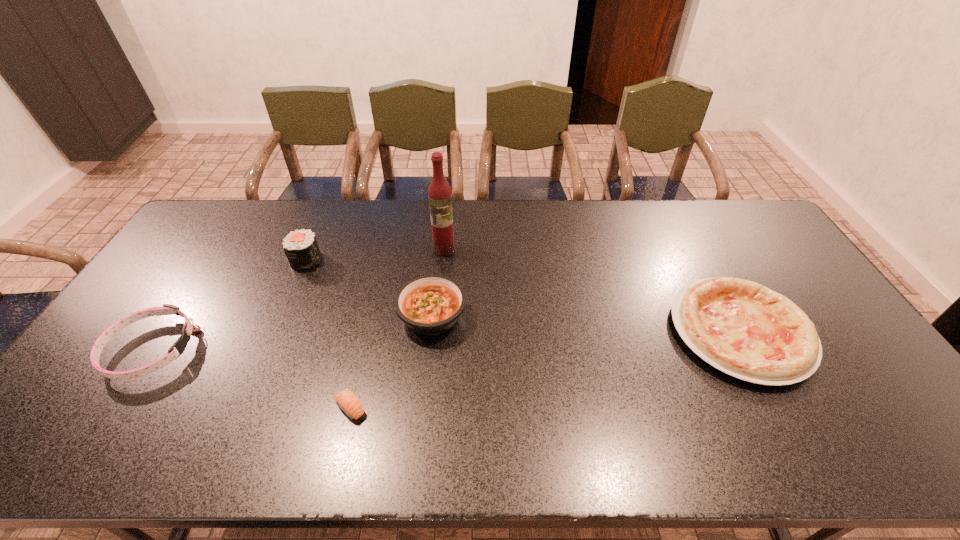
In order to click on free space between the stew and the fourth object from right to left in this screenshot , I will do `click(391, 362)`.

Find the location of a particular element. Image resolution: width=960 pixels, height=540 pixels. vacant space in between the nearest object and the rightmost object is located at coordinates click(545, 370).

Identify the location of free space between the dog collar and the liquor. (298, 299).

Identify the location of empty location between the dog collar and the right sushi. (251, 379).

This screenshot has height=540, width=960. I want to click on vacant space in between the rightmost object and the shortest object, so click(545, 370).

Locate an element on the screen. Image resolution: width=960 pixels, height=540 pixels. vacant space that's between the shorter sushi and the leftmost object is located at coordinates coord(251,379).

At what (x,y) coordinates should I click in order to perform the action: click on vacant area that lies between the leftmost object and the shorter sushi. Please return your answer as a coordinate pair (x, y). The height and width of the screenshot is (540, 960). Looking at the image, I should click on (251, 379).

The height and width of the screenshot is (540, 960). Identify the location of empty space between the nearer sushi and the leftmost object. (251, 379).

Locate an element on the screen. vacant space that's between the stew and the rightmost object is located at coordinates (587, 323).

Locate which object is the fifth closest to the dog collar. Please provide its 2D coordinates. Your answer should be formatted as a tuple, i.e. [(x, y)], where the tuple contains the x and y coordinates of a point satisfying the conditions above.

[(744, 329)]